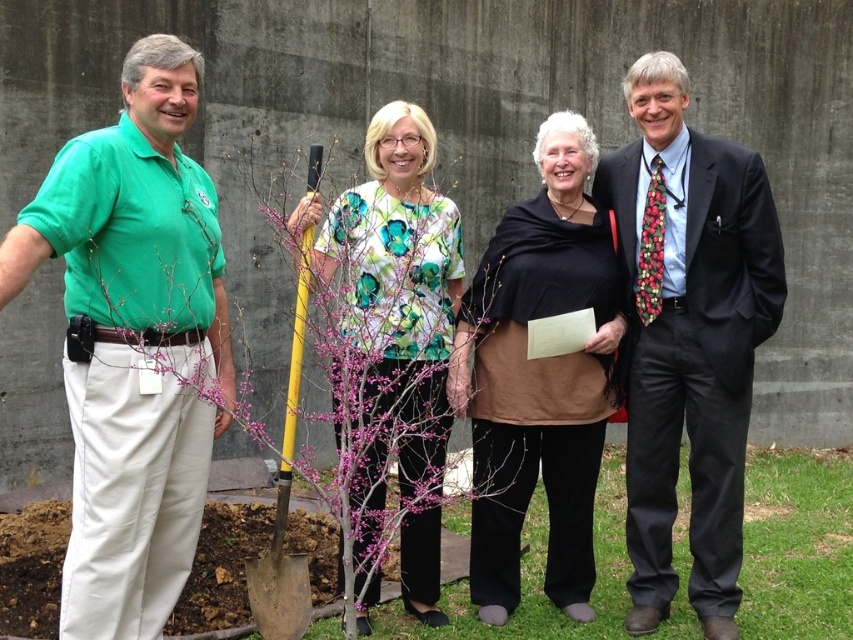
Between black suit at center and brown matte scarf at center, which one is positioned higher?

black suit at center

Which of these two, black suit at center or brown matte scarf at center, stands taller?

black suit at center

Image resolution: width=853 pixels, height=640 pixels. What do you see at coordinates (688, 337) in the screenshot? I see `black suit at center` at bounding box center [688, 337].

Locate an element on the screen. black suit at center is located at coordinates (688, 337).

Which is below, floral printed blouse at center or yellow metal shovel at center?

yellow metal shovel at center

Is floral printed blouse at center bigger than yellow metal shovel at center?

Yes, floral printed blouse at center is bigger than yellow metal shovel at center.

Which is in front, point (439, 317) or point (270, 580)?

Point (270, 580) is in front.

Find the location of a particular element. This screenshot has width=853, height=640. floral printed blouse at center is located at coordinates (399, 284).

Is point (155, 536) positioned before point (228, 632)?

Yes, it is.

Is green cotton shirt at left shorter than bare branches at center?

No, green cotton shirt at left is not shorter than bare branches at center.

Who is more distant from viewer, (172, 97) or (292, 392)?

The point (292, 392) is more distant.

I want to click on green cotton shirt at left, so click(132, 342).